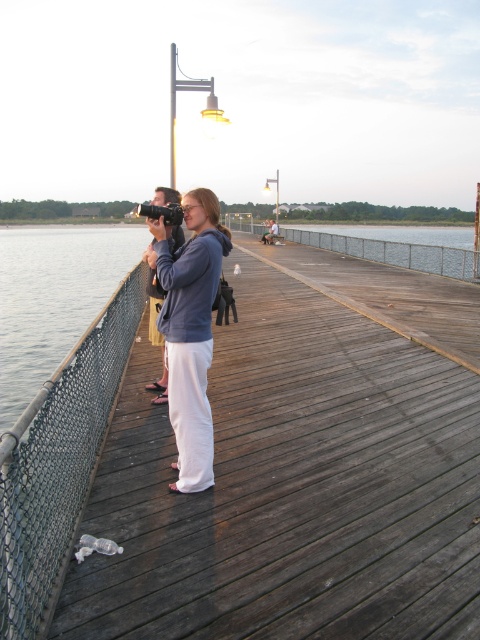
What do you see at coordinates (300, 470) in the screenshot?
I see `dark wood dock at center` at bounding box center [300, 470].

Can you confirm if dark wood dock at center is positioned above matte gray hoodie at center?

Yes, dark wood dock at center is above matte gray hoodie at center.

Who is more forward, (x=407, y=396) or (x=189, y=324)?

Point (x=189, y=324)

This screenshot has width=480, height=640. I want to click on dark wood dock at center, so click(300, 470).